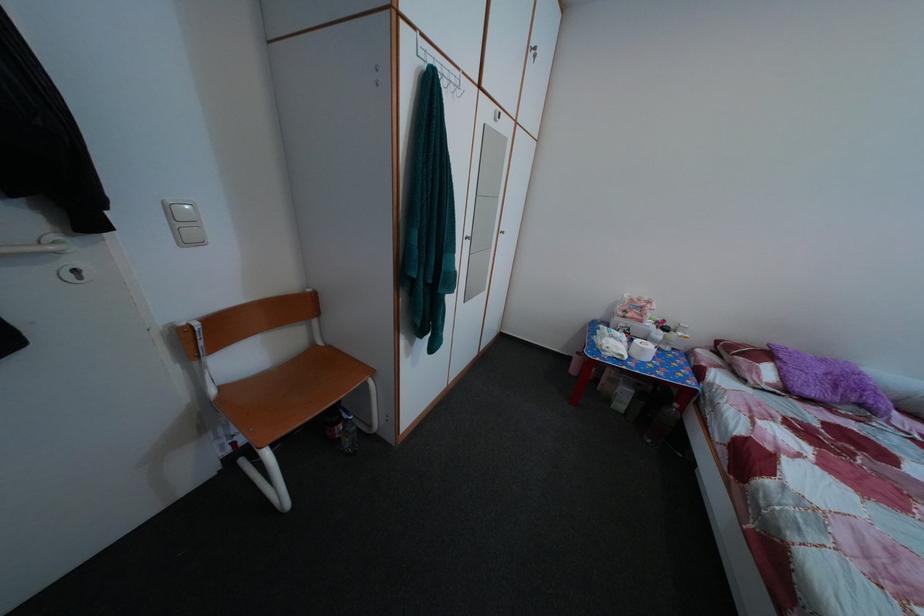
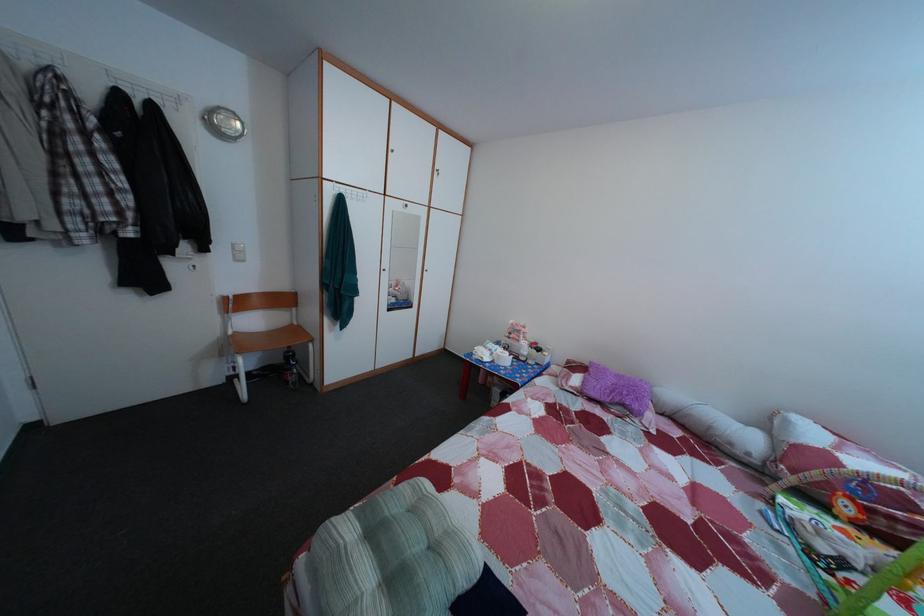
Where in the second image is the point corresponding to point (177, 216) from the first image?

(242, 254)